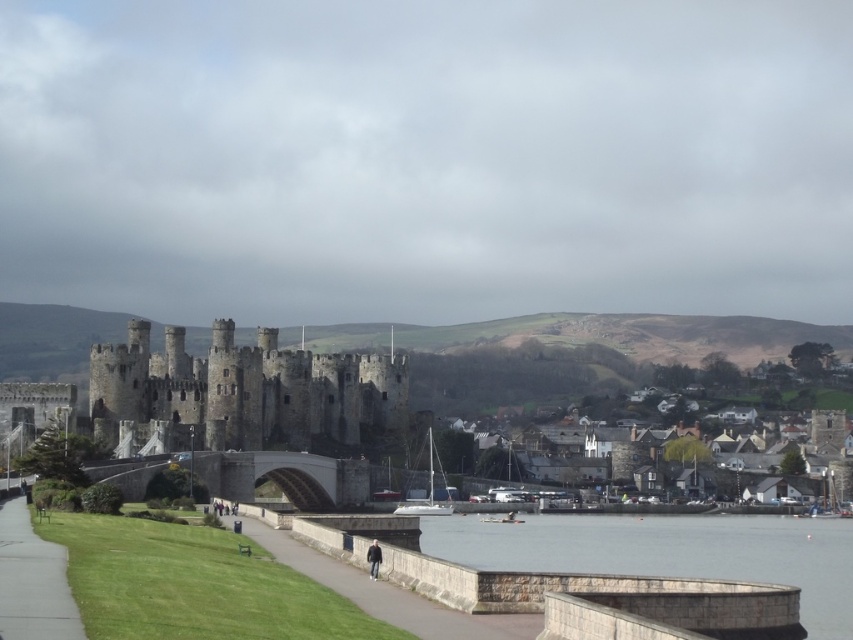
You are a tourist standing on the pathway near the dark gray jacket at lower center. You want to take a photo of the dark gray stone castle at center. Which direction should you face to capture the castle in your shot?

You should face towards the left side, as the dark gray stone castle at center is positioned on the left side of the dark gray jacket at lower center, which is where you are standing.

You are standing at the viewpoint where the image was taken, looking at Conwy Castle. There are two points marked in the scene. Which of the two points, point (326, 557) or point (374, 548), is closer to you?

Point (326, 557) is closer to you because it is further to the viewer than point (374, 548).

You are a tourist standing on the gray concrete path at lower center, looking towards the dark gray stone castle at center. Which object is closer to you?

The gray concrete path at lower center is closer to you since you are standing on it, while the dark gray stone castle at center is further away.